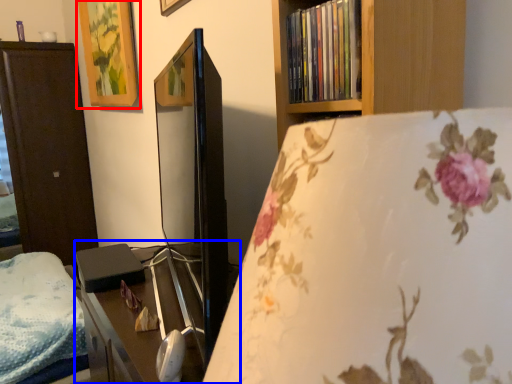
Question: Which object appears closest to the camera in this image, picture frame (highlighted by a red box) or table (highlighted by a blue box)?

Choices:
 (A) picture frame
 (B) table

Answer: (B)